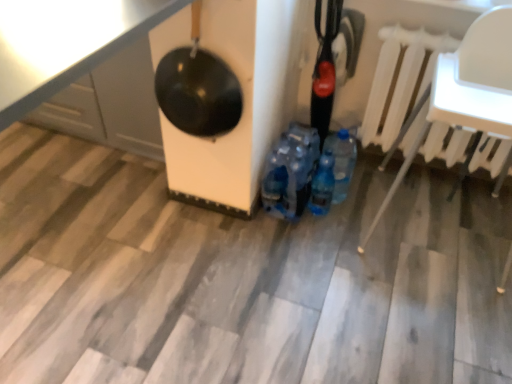
Question: From a real-world perspective, relative to blue translucent bottle at center, is shiny black pan at upper left vertically above or below?

Choices:
 (A) above
 (B) below

Answer: (A)

Question: Would you say shiny black pan at upper left is to the left or to the right of blue translucent bottle at center in the picture?

Choices:
 (A) left
 (B) right

Answer: (A)

Question: Which object is the closest to the shiny black pan at upper left?

Choices:
 (A) blue translucent bottle at center
 (B) white plastic radiator at upper right
 (C) black glossy wok at upper left

Answer: (C)

Question: Estimate the real-world distances between objects in this image. Which object is farther from the blue translucent bottle at center?

Choices:
 (A) white plastic radiator at upper right
 (B) black glossy wok at upper left
 (C) shiny black pan at upper left

Answer: (C)